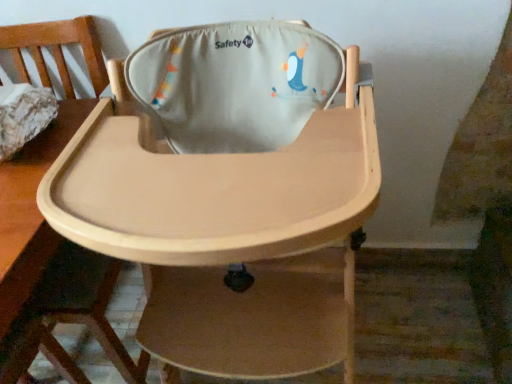
Question: Is matte beige highchair at center, acting as the first chair starting from the left, spatially inside natural wood highchair at center, which is counted as the first chair, starting from the right, or outside of it?

Choices:
 (A) inside
 (B) outside

Answer: (B)

Question: Is matte beige highchair at center, acting as the first chair starting from the left, taller or shorter than natural wood highchair at center, which is the 2th chair from left to right?

Choices:
 (A) tall
 (B) short

Answer: (B)

Question: Looking at their shapes, would you say matte beige highchair at center, acting as the first chair starting from the left, is wider or thinner than natural wood highchair at center, which is the 2th chair from left to right?

Choices:
 (A) thin
 (B) wide

Answer: (B)

Question: Is natural wood highchair at center, which is the 2th chair from left to right, inside or outside of matte beige highchair at center, acting as the first chair starting from the left?

Choices:
 (A) inside
 (B) outside

Answer: (B)

Question: Considering the positions of natural wood highchair at center, which is the 2th chair from left to right, and matte beige highchair at center, the second chair when ordered from right to left, in the image, is natural wood highchair at center, which is the 2th chair from left to right, wider or thinner than matte beige highchair at center, the second chair when ordered from right to left,?

Choices:
 (A) wide
 (B) thin

Answer: (B)

Question: In terms of height, does natural wood highchair at center, which is the 2th chair from left to right, look taller or shorter compared to matte beige highchair at center, the second chair when ordered from right to left?

Choices:
 (A) short
 (B) tall

Answer: (B)

Question: From the image's perspective, is natural wood highchair at center, which is counted as the first chair, starting from the right, located above or below matte beige highchair at center, acting as the first chair starting from the left?

Choices:
 (A) above
 (B) below

Answer: (B)